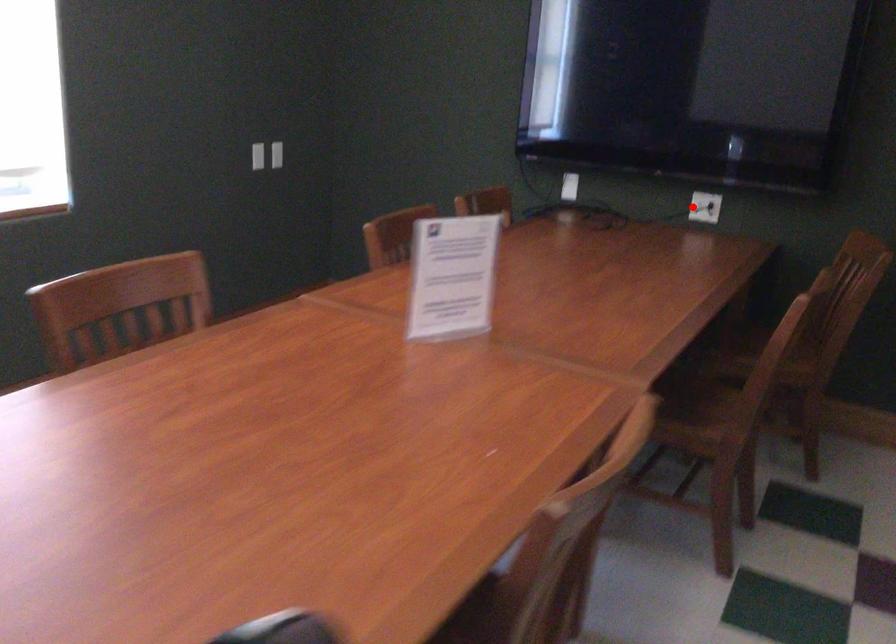
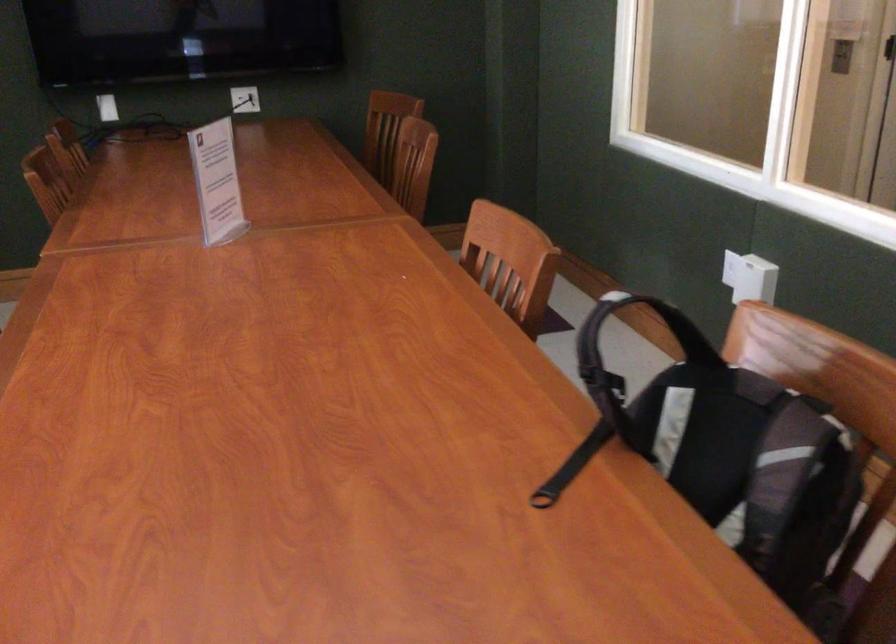
Question: I am providing you with two images of the same scene from different viewpoints. A red point is marked on the first image. Is the red point's position out of view in image 2?

Choices:
 (A) Yes
 (B) No

Answer: (B)